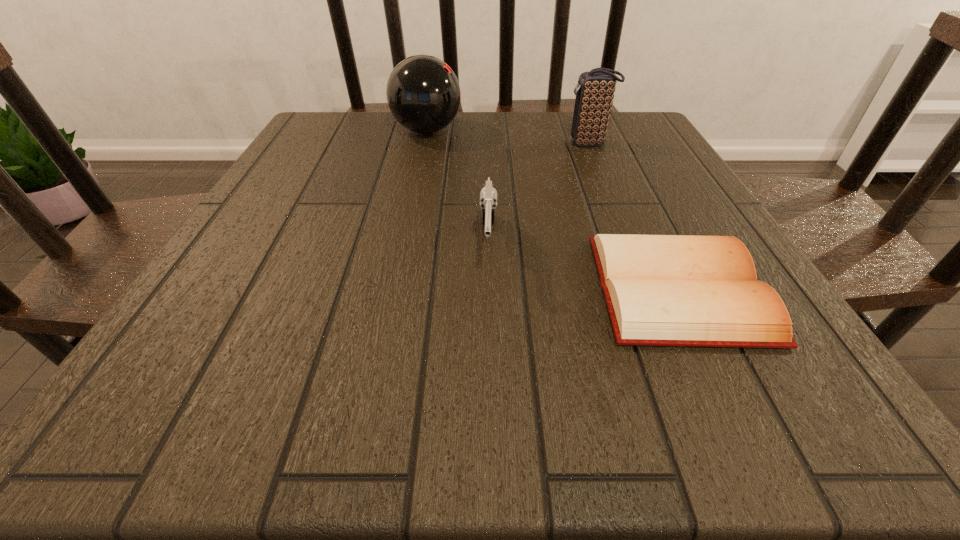
Identify the location of object that is the second closest to the bowling ball. (488, 196).

You are a GUI agent. You are given a task and a screenshot of the screen. Output one action in this format:
    pyautogui.click(x=<x>, y=<y>)
    Task: Click on the vacant space that satisfies the following two spatial constraints: 1. with the zip open on the Bible; 2. on the left side of the clutch bag
    The image size is (960, 540).
    Given the screenshot: What is the action you would take?
    pyautogui.click(x=649, y=288)

The width and height of the screenshot is (960, 540). What are the coordinates of `free spot that satisfies the following two spatial constraints: 1. on the surface of the leftmost object near the finger holes; 2. on the right side of the shortest object` in the screenshot? It's located at (394, 288).

Locate an element on the screen. The height and width of the screenshot is (540, 960). free space that satisfies the following two spatial constraints: 1. at the muzzle of the Bible; 2. on the right side of the second object from left to right is located at coordinates (489, 288).

Where is `vacant point that satisfies the following two spatial constraints: 1. at the muzzle of the Bible; 2. on the left side of the gun`? The image size is (960, 540). vacant point that satisfies the following two spatial constraints: 1. at the muzzle of the Bible; 2. on the left side of the gun is located at coordinates (489, 288).